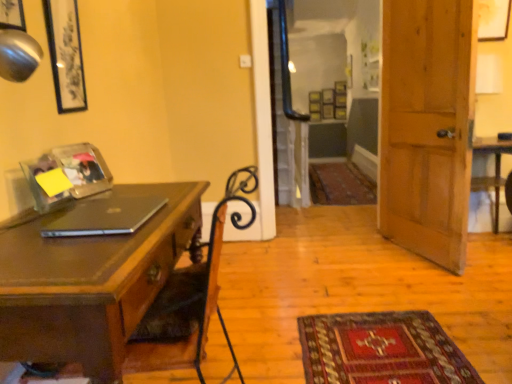
Question: Considering their positions, is clear glass screen door at upper center located in front of or behind wooden door at right?

Choices:
 (A) front
 (B) behind

Answer: (B)

Question: Is point (306, 170) positioned closer to the camera than point (433, 3)?

Choices:
 (A) farther
 (B) closer

Answer: (A)

Question: Estimate the real-world distances between objects in this image. Which object is closer to the wooden desk at left?

Choices:
 (A) sleek black laptop at left
 (B) clear glass screen door at upper center
 (C) clear plastic picture frame at upper left, which is the 2th picture frame from right to left
 (D) matte black picture frame at upper left, the fifth picture frame in the back-to-front sequence
 (E) matte black picture frame at upper left, the fourth picture frame when ordered from right to left

Answer: (A)

Question: Which is nearer to the carpeted mat at center?

Choices:
 (A) wooden door at right
 (B) clear plastic picture frame at upper left, which appears as the third picture frame when viewed from the front
 (C) clear glass screen door at upper center
 (D) wooden desk at left
 (E) matte black picture frame at upper left, which is counted as the 5th picture frame, starting from the right

Answer: (C)